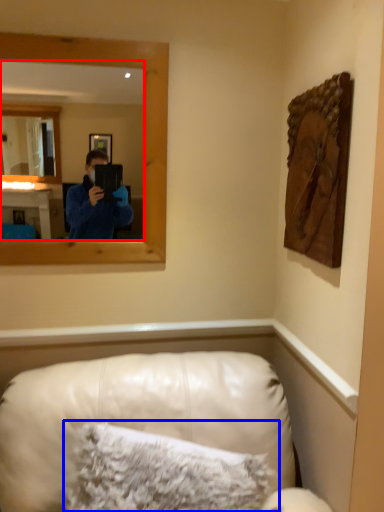
Question: Which object appears farthest to the camera in this image, mirror (highlighted by a red box) or pillow (highlighted by a blue box)?

Choices:
 (A) mirror
 (B) pillow

Answer: (A)